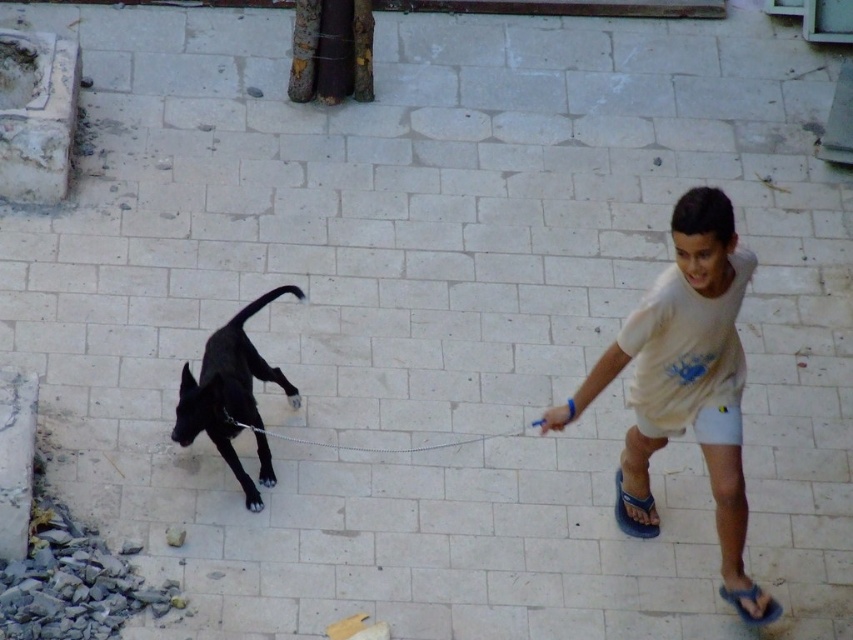
Question: Which object is farther from the camera taking this photo?

Choices:
 (A) silver chain leash at center
 (B) black glossy dog at lower left

Answer: (A)

Question: Does white cotton shirt at right have a larger size compared to silver chain leash at center?

Choices:
 (A) no
 (B) yes

Answer: (B)

Question: Among these points, which one is nearest to the camera?

Choices:
 (A) (296, 436)
 (B) (740, 602)
 (C) (238, 316)

Answer: (B)

Question: Is black glossy dog at lower left above silver chain leash at center?

Choices:
 (A) yes
 (B) no

Answer: (A)

Question: Is white cotton shirt at right smaller than silver chain leash at center?

Choices:
 (A) no
 (B) yes

Answer: (A)

Question: Which object appears closest to the camera in this image?

Choices:
 (A) white cotton shirt at right
 (B) silver chain leash at center
 (C) black glossy dog at lower left

Answer: (A)